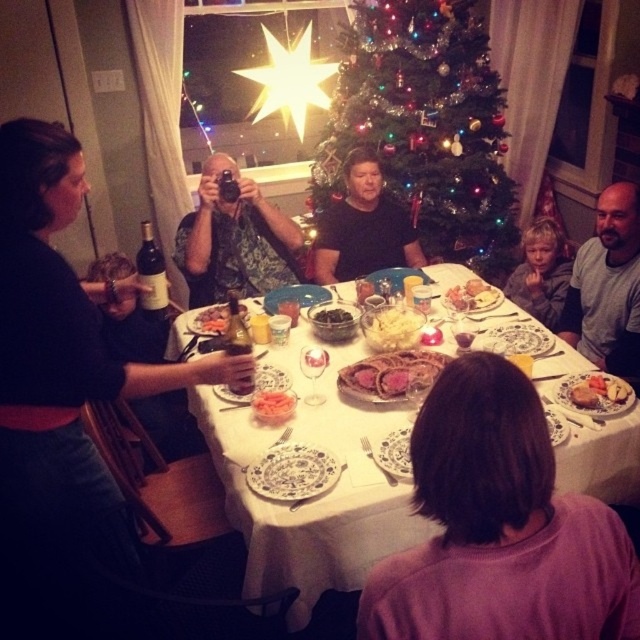
You are a photographer standing at the center of the room. You want to take a photo that includes both the point at (483, 282) and the point at (346, 310). Which point should you focus on to ensure both are in sharp focus?

You should focus on the point that is closer to the camera, which is point (346, 310), because it will ensure that both points are within the depth of field and appear sharp in the photo.

You are a guest at the festive dinner and want to reach for both the golden crispy pastry at center and the green leafy salad at center. Which one is positioned to the right of the other?

The golden crispy pastry at center is to the right of the green leafy salad at center.